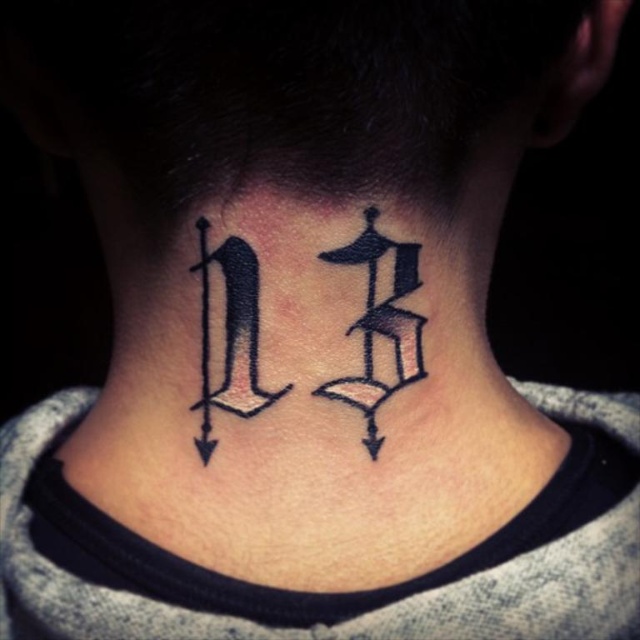
Is black ink letter at center thinner than black ink letter d at center?

No, black ink letter at center is not thinner than black ink letter d at center.

Between black ink letter at center and black ink letter d at center, which one is positioned lower?

black ink letter d at center is below.

Describe the element at coordinates (380, 323) in the screenshot. Image resolution: width=640 pixels, height=640 pixels. I see `black ink letter at center` at that location.

Locate an element on the screen. black ink letter at center is located at coordinates (380, 323).

Which is more to the right, black ink tattoo at center or black ink letter at center?

black ink letter at center

Does black ink tattoo at center appear under black ink letter at center?

Yes.

Is point (244, 284) in front of point (369, 365)?

Yes.

The image size is (640, 640). Identify the location of black ink tattoo at center. (380, 324).

Can you confirm if black ink tattoo at center is thinner than black ink letter d at center?

Incorrect, black ink tattoo at center's width is not less than black ink letter d at center's.

Which is in front, point (353, 397) or point (253, 364)?

Point (253, 364) is in front.

Between point (232, 301) and point (250, 381), which one is positioned behind?

The point (250, 381) is behind.

In order to click on black ink tattoo at center in this screenshot , I will do `click(380, 324)`.